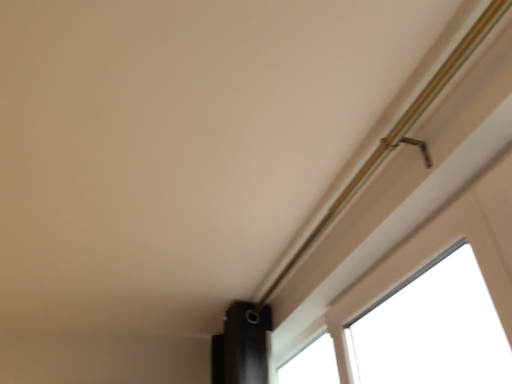
This screenshot has height=384, width=512. Describe the element at coordinates (396, 136) in the screenshot. I see `metallic gold pipe at upper right` at that location.

I want to click on metallic gold pipe at upper right, so click(396, 136).

Measure the distance between point (386, 145) and camera.

They are 3.37 feet apart.

Find the location of a particular element. metallic gold pipe at upper right is located at coordinates (396, 136).